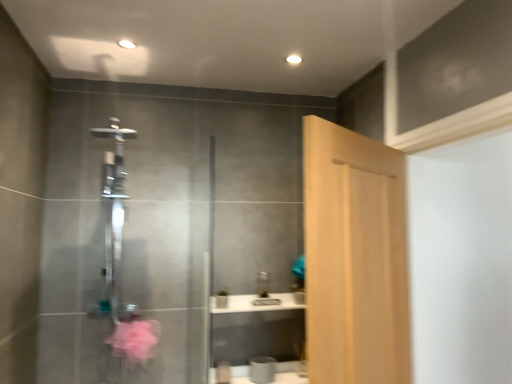
Question: Does clear glass shower at center appear on the left side of light wood door at center?

Choices:
 (A) no
 (B) yes

Answer: (B)

Question: Would you say clear glass shower at center is outside light wood door at center?

Choices:
 (A) yes
 (B) no

Answer: (A)

Question: Is clear glass shower at center not near light wood door at center?

Choices:
 (A) yes
 (B) no

Answer: (A)

Question: From a real-world perspective, does clear glass shower at center stand above light wood door at center?

Choices:
 (A) yes
 (B) no

Answer: (A)

Question: From the image's perspective, is clear glass shower at center on top of light wood door at center?

Choices:
 (A) no
 (B) yes

Answer: (A)

Question: Does clear glass shower at center have a greater height compared to light wood door at center?

Choices:
 (A) no
 (B) yes

Answer: (B)

Question: Can you confirm if light wood door at center is thinner than clear glass shower at center?

Choices:
 (A) no
 (B) yes

Answer: (B)

Question: Is light wood door at center positioned behind clear glass shower at center?

Choices:
 (A) no
 (B) yes

Answer: (A)

Question: Is light wood door at center bigger than clear glass shower at center?

Choices:
 (A) yes
 (B) no

Answer: (A)

Question: Is light wood door at center next to clear glass shower at center?

Choices:
 (A) no
 (B) yes

Answer: (A)

Question: From a real-world perspective, is light wood door at center below clear glass shower at center?

Choices:
 (A) no
 (B) yes

Answer: (B)

Question: Is light wood door at center at the left side of clear glass shower at center?

Choices:
 (A) no
 (B) yes

Answer: (A)

Question: Considering the positions of point pyautogui.click(x=312, y=372) and point pyautogui.click(x=117, y=304), is point pyautogui.click(x=312, y=372) closer or farther from the camera than point pyautogui.click(x=117, y=304)?

Choices:
 (A) farther
 (B) closer

Answer: (B)